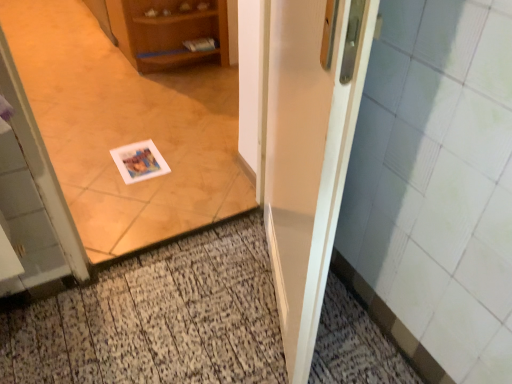
Question: Does white paper at center have a greater height compared to white glossy door at center?

Choices:
 (A) no
 (B) yes

Answer: (A)

Question: Considering the relative sizes of white paper at center and white glossy door at center in the image provided, is white paper at center smaller than white glossy door at center?

Choices:
 (A) yes
 (B) no

Answer: (A)

Question: Considering the relative sizes of white paper at center and white glossy door at center in the image provided, is white paper at center thinner than white glossy door at center?

Choices:
 (A) yes
 (B) no

Answer: (A)

Question: Is white paper at center wider than white glossy door at center?

Choices:
 (A) yes
 (B) no

Answer: (B)

Question: Is white paper at center looking in the opposite direction of white glossy door at center?

Choices:
 (A) yes
 (B) no

Answer: (B)

Question: Is white paper postcard at center to the left or to the right of wooden cabinet at upper left in the image?

Choices:
 (A) right
 (B) left

Answer: (A)

Question: Is white paper postcard at center spatially inside wooden cabinet at upper left, or outside of it?

Choices:
 (A) outside
 (B) inside

Answer: (A)

Question: In the image, is white paper postcard at center positioned in front of or behind wooden cabinet at upper left?

Choices:
 (A) behind
 (B) front

Answer: (B)

Question: From the image's perspective, is white paper postcard at center above or below wooden cabinet at upper left?

Choices:
 (A) below
 (B) above

Answer: (A)

Question: Is wooden cabinet at upper left taller or shorter than white glossy door at center?

Choices:
 (A) short
 (B) tall

Answer: (A)

Question: From the image's perspective, relative to white glossy door at center, is wooden cabinet at upper left above or below?

Choices:
 (A) above
 (B) below

Answer: (A)

Question: Is wooden cabinet at upper left in front of or behind white glossy door at center in the image?

Choices:
 (A) front
 (B) behind

Answer: (B)

Question: Considering the positions of wooden cabinet at upper left and white glossy door at center in the image, is wooden cabinet at upper left wider or thinner than white glossy door at center?

Choices:
 (A) wide
 (B) thin

Answer: (A)

Question: Would you say white paper postcard at center is to the left or to the right of white glossy door at center in the picture?

Choices:
 (A) left
 (B) right

Answer: (A)

Question: From the image's perspective, relative to white glossy door at center, is white paper postcard at center above or below?

Choices:
 (A) below
 (B) above

Answer: (B)